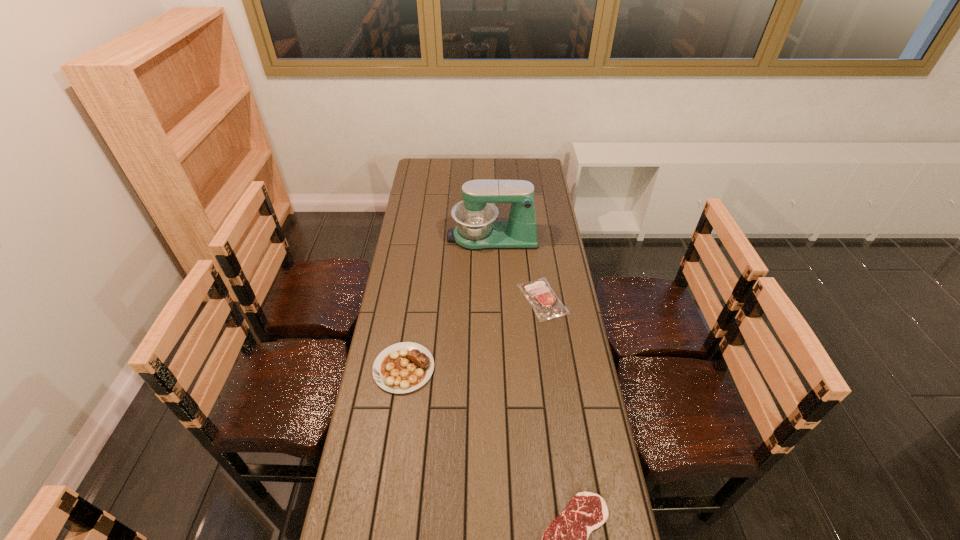
At what (x,y) coordinates should I click in order to perform the action: click on free location that satisfies the following two spatial constraints: 1. on the front-facing side of the farthest object; 2. on the front side of the leftmost steak. Please return your answer as a coordinate pair (x, y). Looking at the image, I should click on (496, 368).